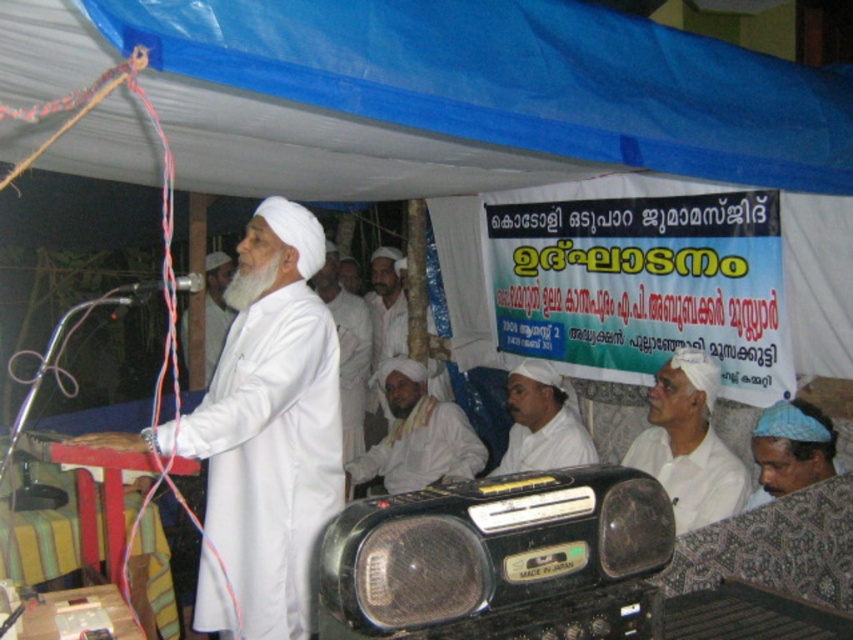
In the scene shown: Can you confirm if black plastic radio at center is positioned below white cloth at center?

Indeed, black plastic radio at center is positioned under white cloth at center.

This screenshot has width=853, height=640. I want to click on black plastic radio at center, so click(498, 560).

Which is behind, point (440, 637) or point (369, 326)?

Point (369, 326)

Image resolution: width=853 pixels, height=640 pixels. In order to click on black plastic radio at center in this screenshot , I will do `click(498, 560)`.

Does white matte/soft robe at center appear on the left side of white matte/silk turban at upper center?

In fact, white matte/soft robe at center is to the right of white matte/silk turban at upper center.

Measure the distance between white matte/soft robe at center and camera.

The distance of white matte/soft robe at center from camera is 2.20 meters.

The image size is (853, 640). In order to click on white matte/soft robe at center in this screenshot , I will do `click(271, 454)`.

Who is positioned more to the left, white matte shirt at lower right or blue fabric cap at lower right?

white matte shirt at lower right is more to the left.

Is point (699, 381) positioned in front of point (772, 477)?

No, (699, 381) is behind (772, 477).

Where is `white matte shirt at lower right`? This screenshot has width=853, height=640. white matte shirt at lower right is located at coordinates (688, 444).